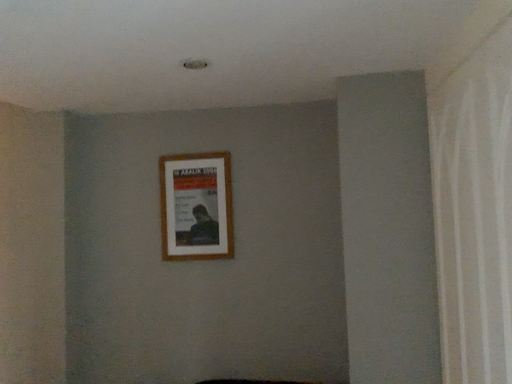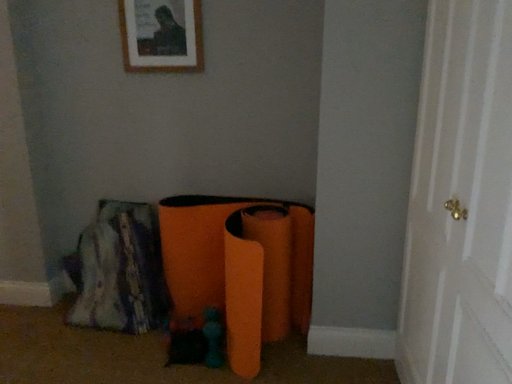
Question: How did the camera likely rotate when shooting the video?

Choices:
 (A) rotated upward
 (B) rotated downward

Answer: (B)